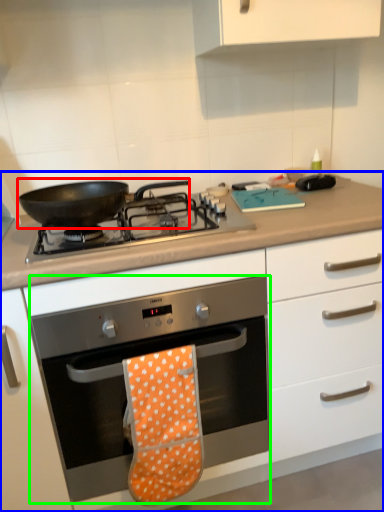
Question: Estimate the real-world distances between objects in this image. Which object is farther from kitchen appliance (highlighted by a red box), cabinetry (highlighted by a blue box) or oven (highlighted by a green box)?

Choices:
 (A) cabinetry
 (B) oven

Answer: (A)